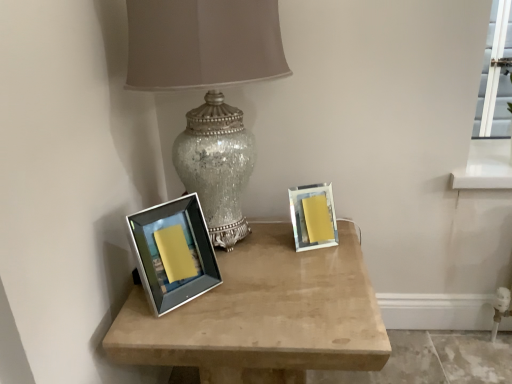
The height and width of the screenshot is (384, 512). I want to click on vacant region in front of silver/metallic picture frame at left, the second picture frame viewed from the back, so click(x=176, y=324).